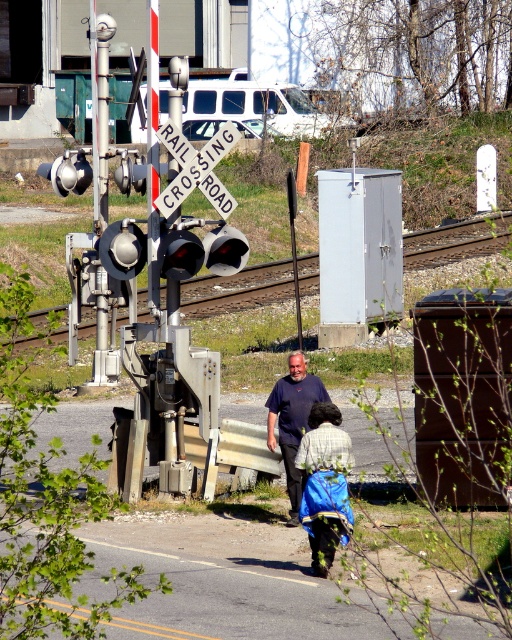
You are a delivery driver approaching the railroad crossing. You need to know if your 2.5 meter wide truck can safely pass through the space between the metal train track at left and the white wooden railroad crossing sign at center. Based on the scene description, can your truck fit through that space?

The metal train track at left has a width larger than the white wooden railroad crossing sign at center. However, the description does not provide specific measurements of the space between them. Without knowing the exact distance between the track and the sign, it is impossible to determine if the truck will fit. You should stop and visually assess the space before proceeding.

You are a pedestrian trying to cross the railroad tracks. You see the metal train track at left and the white wooden railroad crossing sign at center. Which object is closer to the left side of the railroad crossing?

The metal train track at left is to the right of the white wooden railroad crossing sign at center, so the white wooden railroad crossing sign at center is closer to the left side of the railroad crossing.